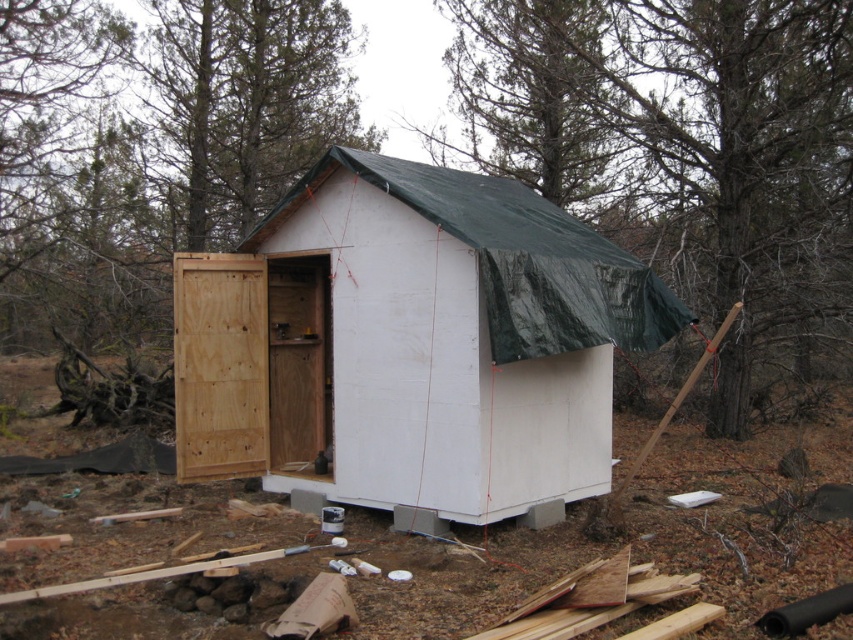
You are a construction worker assessing the shed. Which object, the white wood cabin at center or the green tarp at upper center, is taller?

A: The white wood cabin at center is taller than the green tarp at upper center.

You are standing at the origin point of the coordinate system. You want to move to the white wood cabin at center. What are the coordinates you need to move to?

The coordinates to move to are approximately 0.539 on the x axis and 0.482 on the y axis.

You are a contractor standing at the edge of the construction site. You need to move a heavy tool from the white wood cabin at center to the green tarp at upper center. The path between them is clear. Can you carry the tool directly without needing to adjust your path? Explain why.

The white wood cabin at center is 8.49 meters from the green tarp at upper center. Since the distance is over 8 meters, you can carry the tool directly without needing to adjust your path as the distance is manageable for a contractor to move the tool in one go.